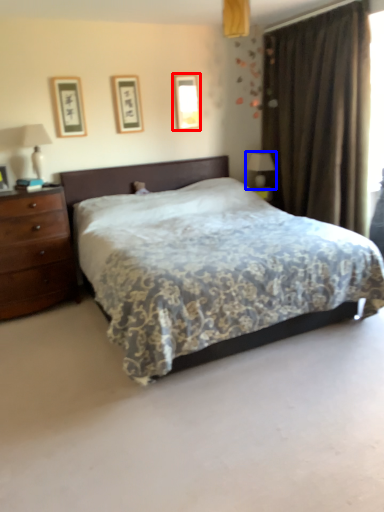
Question: Which object appears closest to the camera in this image, picture frame (highlighted by a red box) or table lamp (highlighted by a blue box)?

Choices:
 (A) picture frame
 (B) table lamp

Answer: (A)